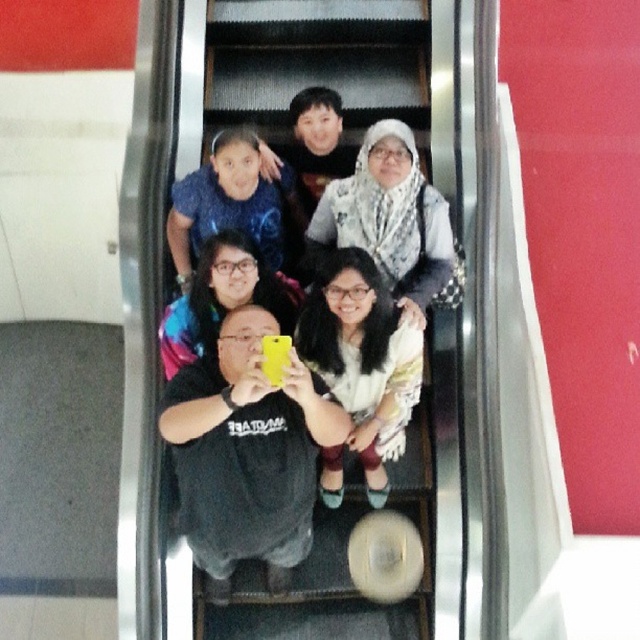
You are standing on the escalator and want to know which of the two points, point (300,561) or point (365,337), is closer to you. Which one is it?

Point (300,561) is closer to you because it is further to the viewer than point (365,337).

You are a photographer trying to capture a closeup of the white lace dress at center and the blue fabric at upper center. Which of these two items should you zoom in on more to ensure they both fit in the frame?

The white lace dress at center is bigger than the blue fabric at upper center, so you should zoom in more on the blue fabric at upper center to ensure both items fit in the frame.

You are standing in front of the escalator and want to reach the point at coordinates point (x=337, y=429). Can you estimate how far you need to walk to reach that point?

The point (x=337, y=429) is 12.26 feet away from the viewer, so you need to walk approximately 12.26 feet to reach it.